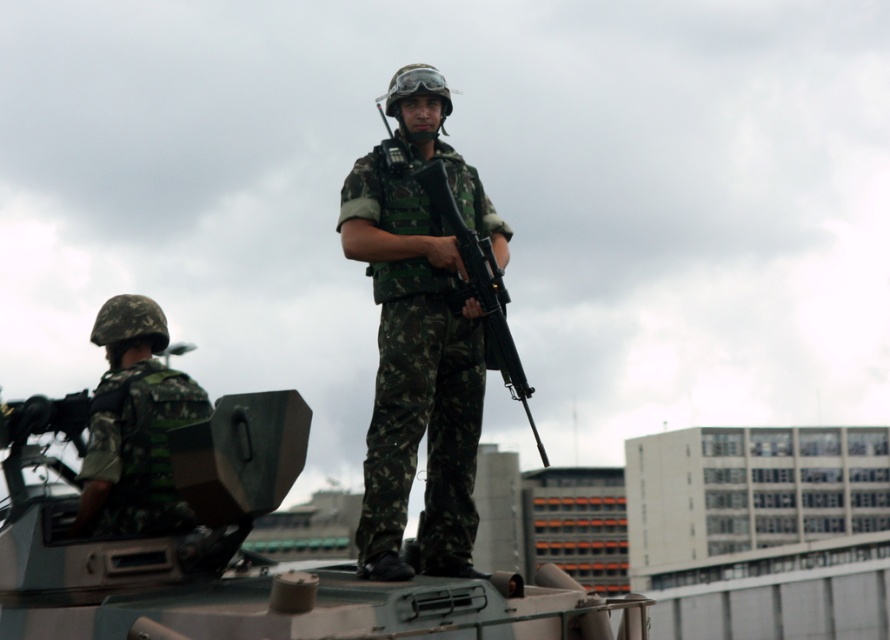
Which is more to the left, camouflage fabric tank at center or camo uniform at center?

camouflage fabric tank at center

Describe the element at coordinates (240, 550) in the screenshot. This screenshot has width=890, height=640. I see `camouflage fabric tank at center` at that location.

Where is `camouflage fabric tank at center`? The height and width of the screenshot is (640, 890). camouflage fabric tank at center is located at coordinates (240, 550).

Is camo uniform at center shorter than camouflage fabric helmet at left?

In fact, camo uniform at center may be taller than camouflage fabric helmet at left.

Does point (425, 563) come behind point (111, 339)?

Yes, point (425, 563) is behind point (111, 339).

Image resolution: width=890 pixels, height=640 pixels. Describe the element at coordinates (419, 336) in the screenshot. I see `camo uniform at center` at that location.

Find the location of a particular element. Image resolution: width=890 pixels, height=640 pixels. camo uniform at center is located at coordinates (419, 336).

How distant is camouflage fabric tank at center from camouflage fabric helmet at left?

6.72 feet

Where is `camouflage fabric tank at center`? This screenshot has width=890, height=640. camouflage fabric tank at center is located at coordinates (240, 550).

I want to click on camouflage fabric tank at center, so click(240, 550).